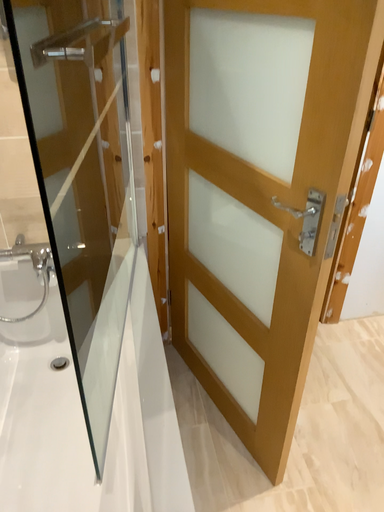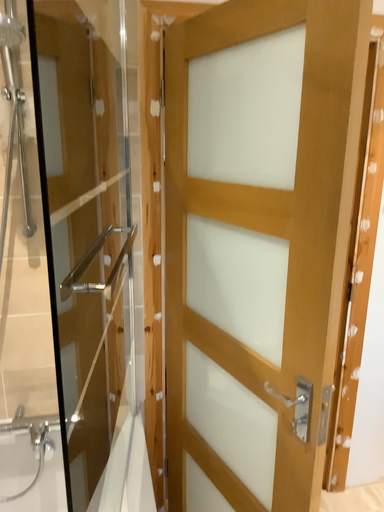
Question: How did the camera likely rotate when shooting the video?

Choices:
 (A) rotated downward
 (B) rotated upward

Answer: (B)